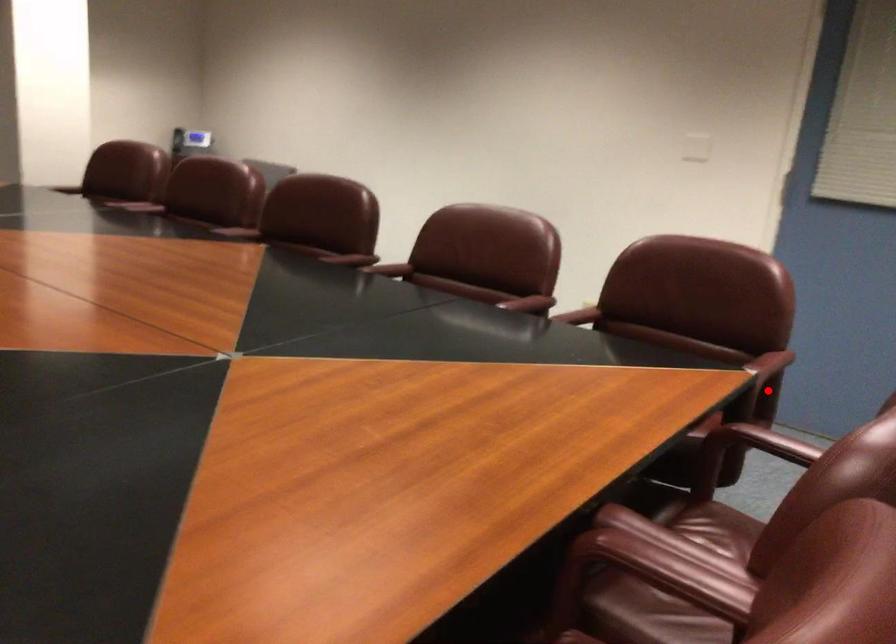
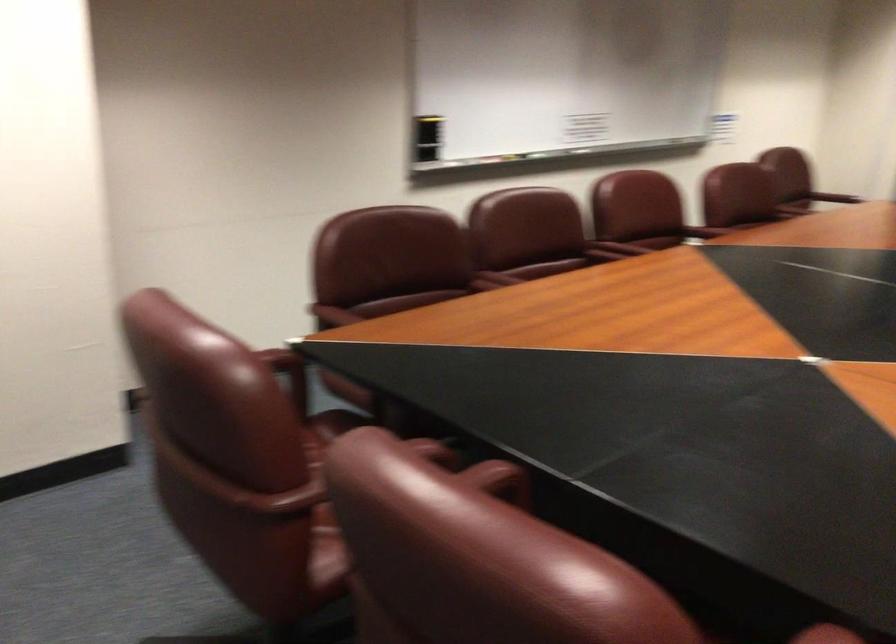
Question: I am providing you with two images of the same scene from different viewpoints. In image1, a red point is highlighted. Considering the same 3D point in image2, which of the following is correct?

Choices:
 (A) It is closer
 (B) It is farther

Answer: (A)